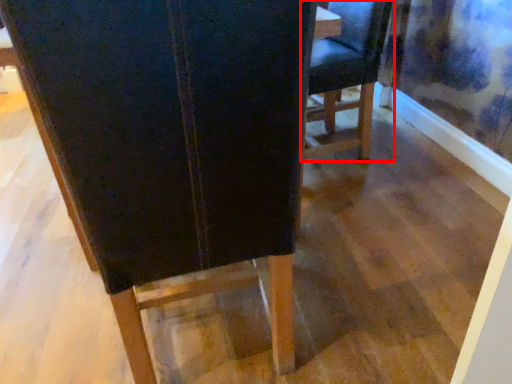
Question: Observing the image, what is the correct spatial positioning of chair (annotated by the red box) in reference to chair?

Choices:
 (A) right
 (B) left

Answer: (A)